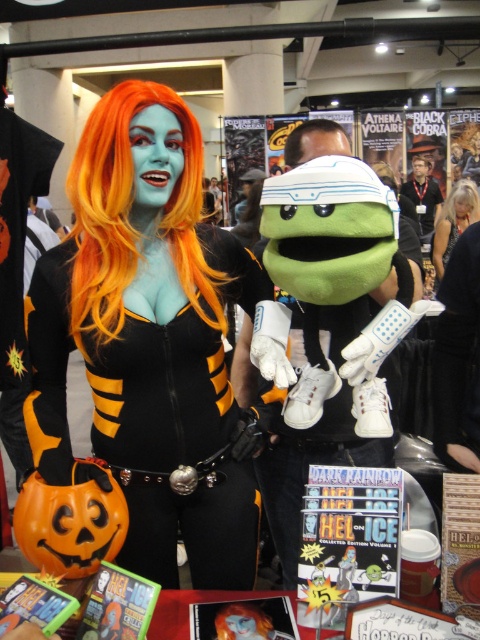
Does matte black costume at center have a lesser width compared to black matte wig at upper center?

No, matte black costume at center is not thinner than black matte wig at upper center.

The image size is (480, 640). What do you see at coordinates (148, 342) in the screenshot?
I see `matte black costume at center` at bounding box center [148, 342].

Identify the location of matte black costume at center. This screenshot has height=640, width=480. (148, 342).

The image size is (480, 640). Describe the element at coordinates (148, 342) in the screenshot. I see `matte black costume at center` at that location.

Can you confirm if matte black costume at center is bigger than blonde synthetic wig at upper right?

Yes, matte black costume at center is bigger than blonde synthetic wig at upper right.

Is point (103, 483) closer to camera compared to point (453, 205)?

Yes.

Locate an element on the screen. This screenshot has height=640, width=480. matte black costume at center is located at coordinates (148, 342).

Which of these two, orange synthetic wig at center or black matte wig at upper center, stands taller?

black matte wig at upper center is taller.

Does orange synthetic wig at center have a lesser height compared to black matte wig at upper center?

Yes.

In the scene shown: Who is more distant from viewer, (189, 252) or (435, 282)?

Point (435, 282)

The width and height of the screenshot is (480, 640). Find the location of `orange synthetic wig at center`. orange synthetic wig at center is located at coordinates (129, 214).